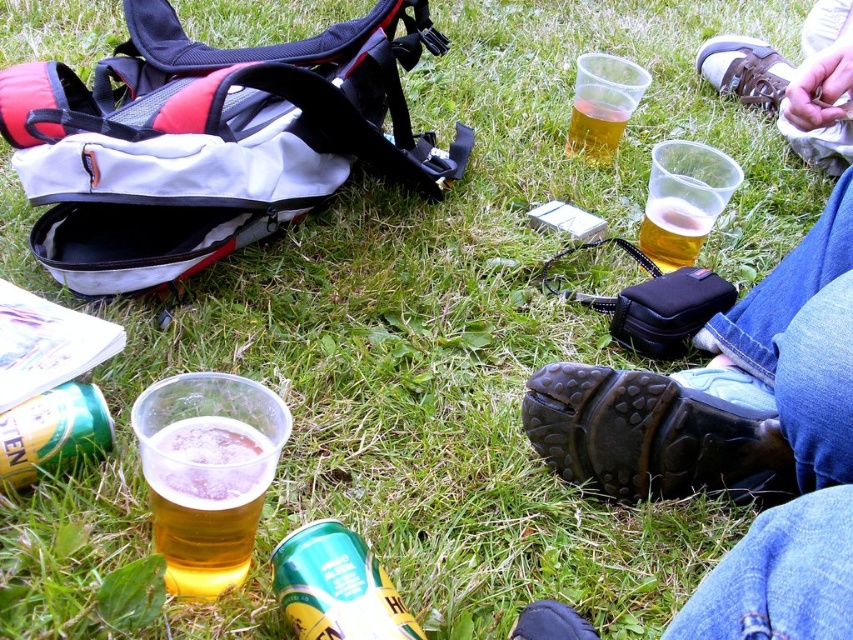
Question: Does blue denim jeans at lower right come in front of translucent plastic cup at upper center?

Choices:
 (A) yes
 (B) no

Answer: (A)

Question: Which point is closer to the camera?

Choices:
 (A) (699, 396)
 (B) (676, 218)
 (C) (4, 440)
 (D) (561, 625)

Answer: (D)

Question: Observing the image, what is the correct spatial positioning of translucent plastic cup at center in reference to green matte can at lower left?

Choices:
 (A) above
 (B) below

Answer: (A)

Question: Among these objects, which one is farthest from the camera?

Choices:
 (A) translucent plastic cup at upper center
 (B) green matte can at lower left
 (C) green matte can at lower center

Answer: (A)

Question: Is the position of green matte can at lower center more distant than that of translucent plastic cup at upper center?

Choices:
 (A) no
 (B) yes

Answer: (A)

Question: Among these points, which one is farthest from the camera?

Choices:
 (A) (86, 397)
 (B) (672, 465)
 (C) (308, 637)

Answer: (B)